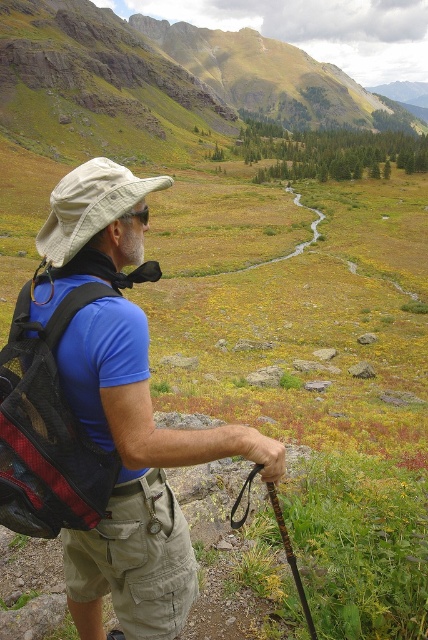
You are a hiker who wants to ensure your gear is visible to others. Which item, the matte blue shirt at center or the red mesh backpack at left, is positioned higher up on your body to be more noticeable?

The matte blue shirt at center is taller than the red mesh backpack at left, so it is positioned higher up and would be more noticeable.